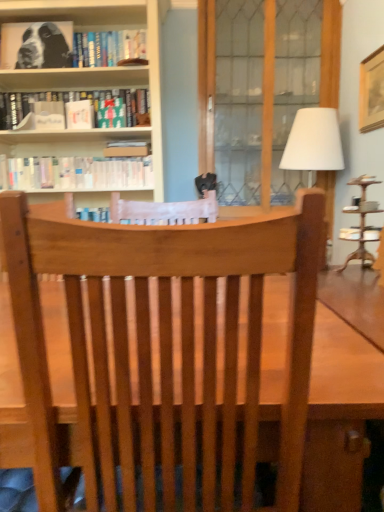
You are a GUI agent. You are given a task and a screenshot of the screen. Output one action in this format:
    pyautogui.click(x=<x>, y=<y>)
    Task: Click on the wooden screen door at center
    The image size is (384, 512).
    Given the screenshot: What is the action you would take?
    click(x=239, y=101)

The width and height of the screenshot is (384, 512). Identify the location of wooden picture frame at upper right. (371, 92).

Identify the location of black and white print at upper left, arranged as the 1th book when viewed from the top. (69, 46).

From the image's perspective, is white matte book at upper center on top of wooden picture frame at upper right?

No.

Is wooden picture frame at upper right a part of white matte book at upper center?

Definitely not — wooden picture frame at upper right is not inside white matte book at upper center.

Can you confirm if white matte book at upper center is positioned to the right of wooden picture frame at upper right?

No, white matte book at upper center is not to the right of wooden picture frame at upper right.

Can you confirm if white matte book at upper center is thinner than wooden picture frame at upper right?

In fact, white matte book at upper center might be wider than wooden picture frame at upper right.

Does white fabric lampshade at right contain wooden screen door at center?

No, wooden screen door at center is not inside white fabric lampshade at right.

Is white fabric lampshade at right at the left side of wooden screen door at center?

No.

Is point (290, 163) closer to camera compared to point (235, 18)?

Yes.

Is white fabric lampshade at right directly adjacent to wooden screen door at center?

No.

From a real-world perspective, is wooden picture frame at upper right under hardcover book at upper left, arranged as the 2th book when viewed from the top?

Actually, wooden picture frame at upper right is physically above hardcover book at upper left, arranged as the 2th book when viewed from the top, in the real world.

Which of these two, wooden picture frame at upper right or hardcover book at upper left, arranged as the 2th book when viewed from the top, stands shorter?

With less height is hardcover book at upper left, arranged as the 2th book when viewed from the top.

Is wooden picture frame at upper right far from hardcover book at upper left, which ranks as the 2th book in bottom-to-top order?

Yes, wooden picture frame at upper right and hardcover book at upper left, which ranks as the 2th book in bottom-to-top order, are located far from each other.

Would you consider wooden picture frame at upper right to be distant from white matte book at upper center?

wooden picture frame at upper right is positioned a significant distance from white matte book at upper center.

Where is `paperback book behind the wooden picture frame at upper right`? This screenshot has height=512, width=384. paperback book behind the wooden picture frame at upper right is located at coordinates (79, 115).

Which object is more forward, wooden picture frame at upper right or white matte book at upper center?

Positioned in front is wooden picture frame at upper right.

Who is bigger, wooden picture frame at upper right or white matte book at upper center?

With larger size is wooden picture frame at upper right.

Looking at this image, would you say white fabric lampshade at right is to the left or to the right of white paperbacks at upper left, the 1th book ordered from the bottom, in the picture?

In the image, white fabric lampshade at right appears on the right side of white paperbacks at upper left, the 1th book ordered from the bottom.

Looking at this image, is white fabric lampshade at right far away from white paperbacks at upper left, the 3th book when ordered from top to bottom?

Yes, white fabric lampshade at right is far from white paperbacks at upper left, the 3th book when ordered from top to bottom.

From the picture: Between white fabric lampshade at right and white paperbacks at upper left, the 3th book when ordered from top to bottom, which one has more height?

white fabric lampshade at right.

Looking at this image, does white fabric lampshade at right have a smaller size compared to hardcover book at upper left, arranged as the 2th book when viewed from the top?

No.

Is point (305, 149) more distant than point (144, 124)?

No, it is in front of (144, 124).

Considering the relative positions of white fabric lampshade at right and hardcover book at upper left, arranged as the 2th book when viewed from the top, in the image provided, is white fabric lampshade at right in front of hardcover book at upper left, arranged as the 2th book when viewed from the top,?

Yes.

This screenshot has width=384, height=512. Identify the location of table lamp below the hardcover book at upper left, arranged as the 2th book when viewed from the top (from the image's perspective). (314, 142).

Based on the photo, considering their positions, is white matte book at upper center located in front of or behind white paperbacks at upper left, the 3th book when ordered from top to bottom?

Visually, white matte book at upper center is located in front of white paperbacks at upper left, the 3th book when ordered from top to bottom.

Which of these two, white matte book at upper center or white paperbacks at upper left, the 3th book when ordered from top to bottom, is wider?

Wider between the two is white paperbacks at upper left, the 3th book when ordered from top to bottom.

Can you see white matte book at upper center touching white paperbacks at upper left, the 1th book ordered from the bottom?

white matte book at upper center and white paperbacks at upper left, the 1th book ordered from the bottom, are clearly separated.

Between white matte book at upper center and white paperbacks at upper left, the 1th book ordered from the bottom, which one appears on the left side from the viewer's perspective?

From the viewer's perspective, white paperbacks at upper left, the 1th book ordered from the bottom, appears more on the left side.

Image resolution: width=384 pixels, height=512 pixels. In order to click on picture frame located on the right of white matte book at upper center in this screenshot , I will do `click(371, 92)`.

I want to click on screen door behind the white fabric lampshade at right, so click(239, 101).

Looking at the image, which one is located further to white matte book at upper center, wooden slatted chair at center or wooden screen door at center?

Based on the image, wooden slatted chair at center appears to be further to white matte book at upper center.

Based on the photo, based on their spatial positions, is black and white print at upper left, arranged as the 1th book when viewed from the top, or white paperbacks at upper left, the 3th book when ordered from top to bottom, further from white matte book at upper center?

black and white print at upper left, arranged as the 1th book when viewed from the top, is positioned further to the anchor white matte book at upper center.

Considering their positions, is white fabric lampshade at right positioned closer to wooden screen door at center than white matte book at upper center?

The object closer to wooden screen door at center is white fabric lampshade at right.

Looking at the image, which one is located closer to hardcover book at upper left, which ranks as the 2th book in bottom-to-top order, wooden picture frame at upper right or white fabric lampshade at right?

white fabric lampshade at right lies closer to hardcover book at upper left, which ranks as the 2th book in bottom-to-top order, than the other object.

Estimate the real-world distances between objects in this image. Which object is closer to wooden screen door at center, white paperbacks at upper left, the 3th book when ordered from top to bottom, or wooden picture frame at upper right?

Based on the image, wooden picture frame at upper right appears to be nearer to wooden screen door at center.

Based on their spatial positions, is black and white print at upper left, arranged as the 1th book when viewed from the top, or white fabric lampshade at right further from white matte book at upper center?

The object further to white matte book at upper center is white fabric lampshade at right.

Based on their spatial positions, is white matte book at upper center or hardcover book at upper left, which ranks as the 2th book in bottom-to-top order, further from white fabric lampshade at right?

white matte book at upper center.

Based on their spatial positions, is wooden picture frame at upper right or wooden slatted chair at center closer to white matte book at upper center?

Among the two, wooden picture frame at upper right is located nearer to white matte book at upper center.

Where is `table lamp between wooden picture frame at upper right and wooden screen door at center along the z-axis`? table lamp between wooden picture frame at upper right and wooden screen door at center along the z-axis is located at coordinates pyautogui.click(x=314, y=142).

Where is `book located between wooden slatted chair at center and black and white print at upper left, arranged as the 1th book when viewed from the top, in the depth direction`? The height and width of the screenshot is (512, 384). book located between wooden slatted chair at center and black and white print at upper left, arranged as the 1th book when viewed from the top, in the depth direction is located at coordinates (78, 173).

This screenshot has width=384, height=512. I want to click on screen door located between black and white print at upper left, acting as the third book starting from the bottom, and white fabric lampshade at right in the left-right direction, so click(239, 101).

This screenshot has height=512, width=384. Find the location of `book located between black and white print at upper left, arranged as the 1th book when viewed from the top, and wooden screen door at center in the left-right direction`. book located between black and white print at upper left, arranged as the 1th book when viewed from the top, and wooden screen door at center in the left-right direction is located at coordinates (78, 173).